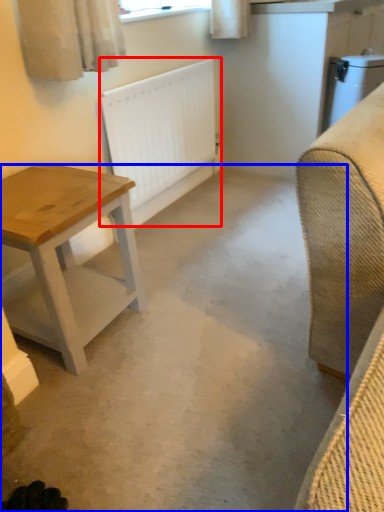
Question: Which of the following is the farthest to the observer, radiator (highlighted by a red box) or concrete (highlighted by a blue box)?

Choices:
 (A) radiator
 (B) concrete

Answer: (A)